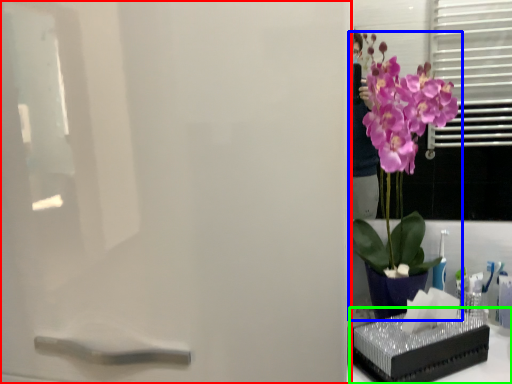
Question: Based on their relative distances, which object is nearer to screen door (highlighted by a red box)? Choose from houseplant (highlighted by a blue box) and window sill (highlighted by a green box).

Choices:
 (A) houseplant
 (B) window sill

Answer: (A)